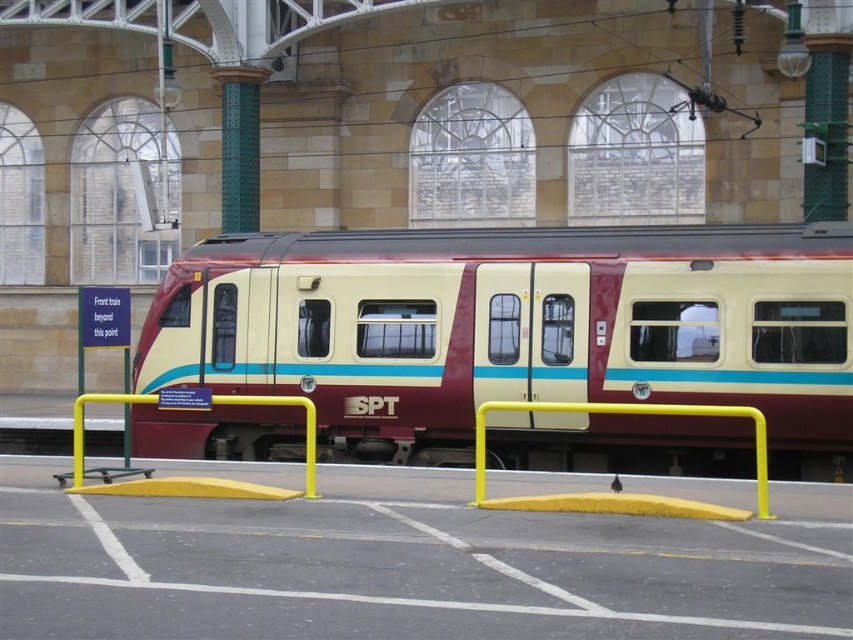
Consider the image. You are a maintenance worker checking the height clearance for the maroon matte train at center. You need to ensure it can pass under the yellow matte rail at center without any issues. Based on the scene, can the train safely pass under the rail?

The maroon matte train at center is not as tall as yellow matte rail at center, so the train can safely pass under the rail without any issues.

You are a visually impaired person standing at the train station platform. You feel the yellow rubber curb at center under your feet. Based on the tactile paving, can you determine your current position relative to the edge of the platform?

The yellow rubber curb at center is located at point (410, 564), which means you are standing near the center of the platform away from the edge. Stay safe and avoid moving towards the train tracks.

What is the spatial relationship between the maroon matte train at center and the yellow rubber curb at center from the observer perspective?

The maroon matte train at center is closer to the observer than the yellow rubber curb at center, as it is positioned further to the viewer.